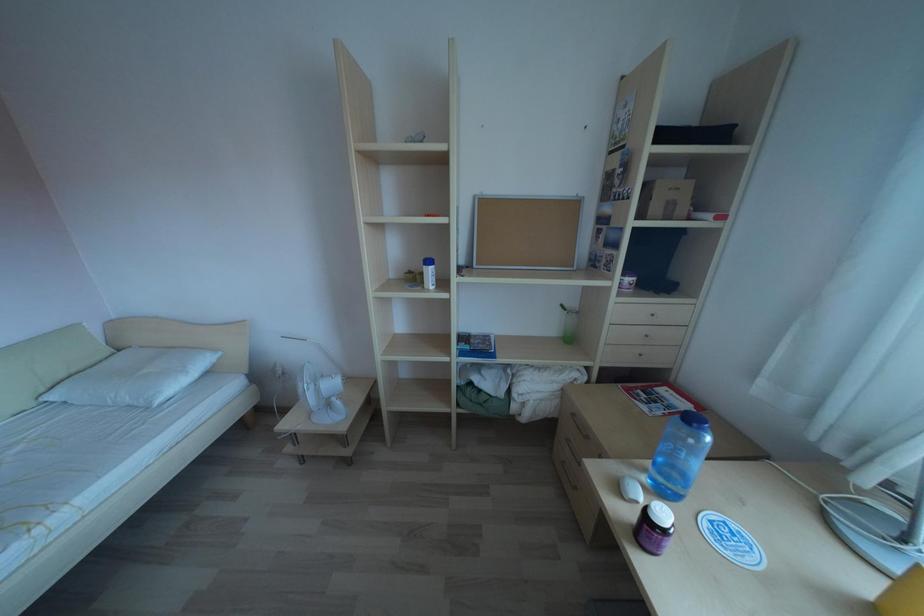
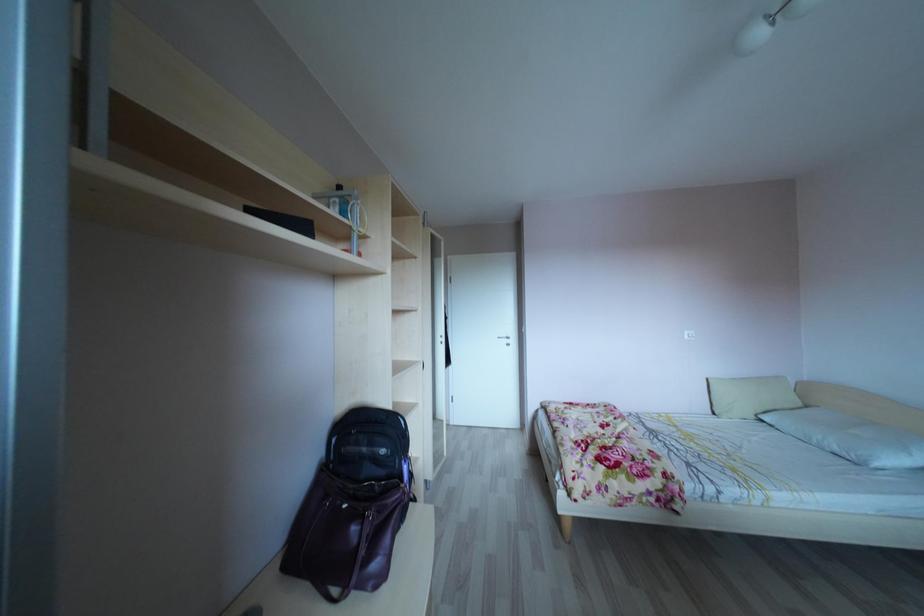
Question: The camera is either moving clockwise (left) or counter-clockwise (right) around the object. The first image is from the beginning of the video and the second image is from the end. Is the camera moving left or right when shooting the video?

Choices:
 (A) Left
 (B) Right

Answer: (B)